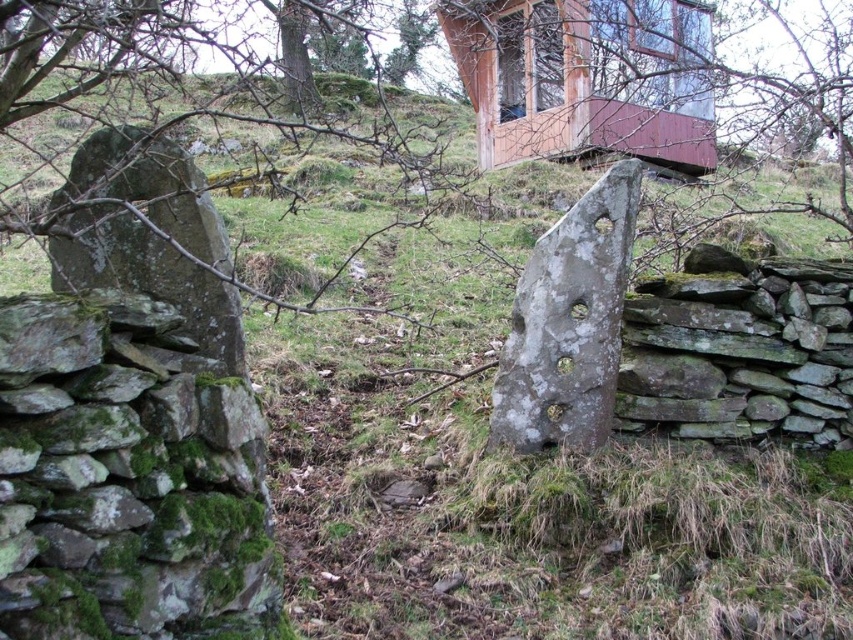
Can you confirm if wooden hut at upper center is wider than gray stone at center?

Yes.

Which is in front, point (663, 161) or point (572, 221)?

Point (572, 221) is in front.

Does point (708, 86) lie behind point (561, 444)?

Yes, point (708, 86) is behind point (561, 444).

What are the coordinates of `wooden hut at upper center` in the screenshot? It's located at (585, 77).